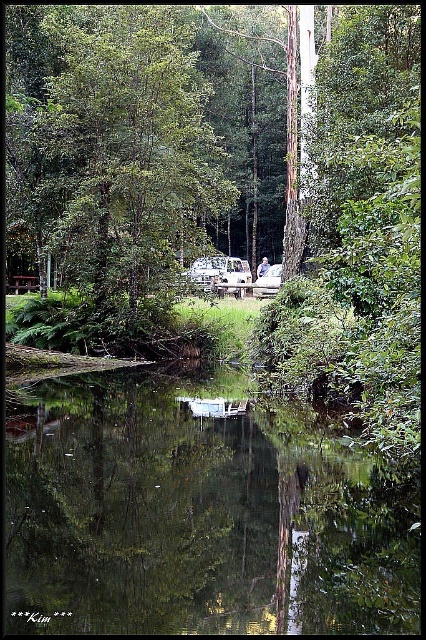
Can you confirm if green leafy tree at center is positioned to the right of white plastic camper van at center?

In fact, green leafy tree at center is to the left of white plastic camper van at center.

Can you confirm if green leafy tree at center is thinner than white plastic camper van at center?

Incorrect, green leafy tree at center's width is not less than white plastic camper van at center's.

Who is more forward, (x=121, y=48) or (x=187, y=273)?

Point (x=121, y=48) is in front.

The image size is (426, 640). What are the coordinates of `green leafy tree at center` in the screenshot? It's located at (127, 157).

Between green reflective water at center and green leafy tree at center, which one appears on the left side from the viewer's perspective?

green leafy tree at center is more to the left.

The height and width of the screenshot is (640, 426). In order to click on green reflective water at center in this screenshot , I will do tap(193, 515).

Identify the location of green reflective water at center. (193, 515).

Can you confirm if green reflective water at center is positioned below white plastic camper van at center?

Yes, green reflective water at center is below white plastic camper van at center.

Find the location of `green reflective water at center`. green reflective water at center is located at coordinates (193, 515).